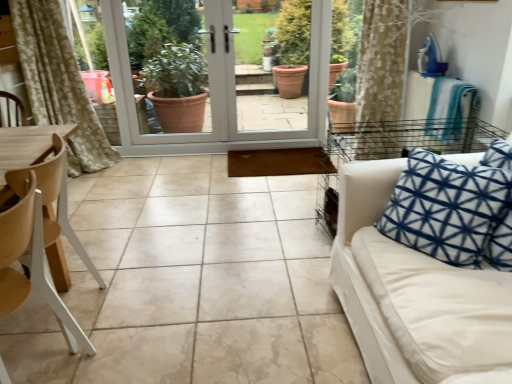
You are a GUI agent. You are given a task and a screenshot of the screen. Output one action in this format:
    pyautogui.click(x=<x>, y=<y>)
    Task: Click on the vacant area that is situated to the right of white wood chair at left, the 1th chair positioned from the front
    Image resolution: width=512 pixels, height=384 pixels.
    Given the screenshot: What is the action you would take?
    pyautogui.click(x=136, y=353)